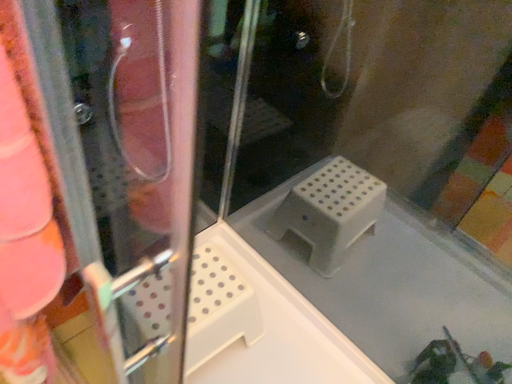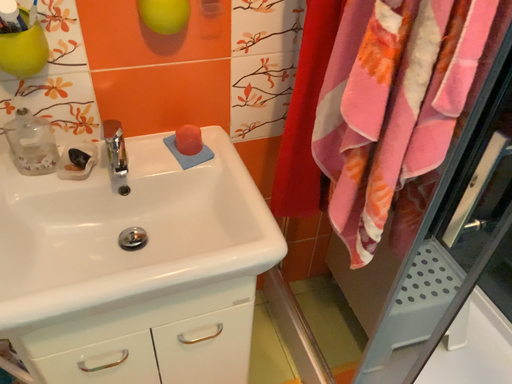
Question: Which way did the camera rotate in the video?

Choices:
 (A) rotated upward
 (B) rotated downward

Answer: (A)